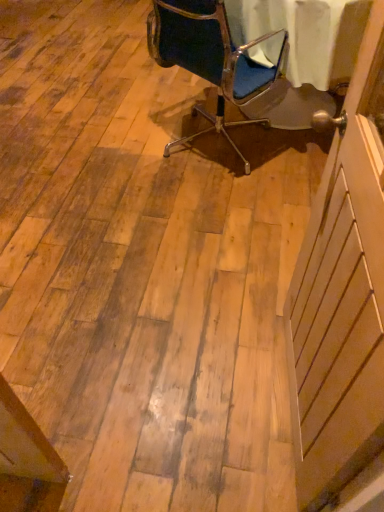
You are a GUI agent. You are given a task and a screenshot of the screen. Output one action in this format:
    pyautogui.click(x=<x>, y=<y>)
    Task: Click on the vacant space underneath white wood screen door at right (from a real-world perspective)
    This screenshot has width=384, height=512.
    Given the screenshot: What is the action you would take?
    pyautogui.click(x=277, y=399)